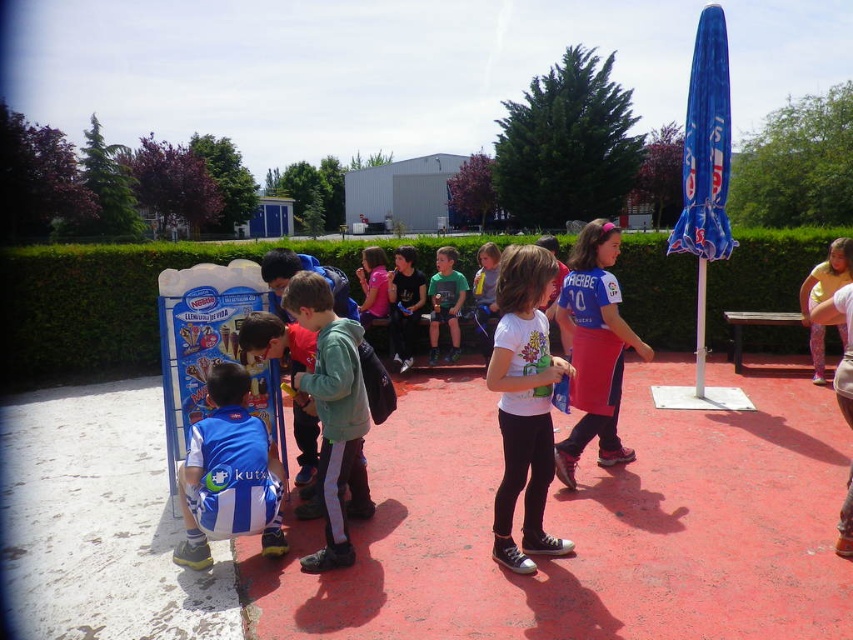
Question: Which point is farther to the camera?

Choices:
 (A) (514, 323)
 (B) (618, 298)
 (C) (131, 282)
 (D) (459, 282)

Answer: (D)

Question: Is pink fabric apron at center below blue and white jersey at lower left?

Choices:
 (A) yes
 (B) no

Answer: (B)

Question: Can you confirm if pink fabric apron at center is positioned to the right of green matte shirt at center?

Choices:
 (A) yes
 (B) no

Answer: (A)

Question: Which of the following is the farthest from the observer?

Choices:
 (A) green hedge at lower left
 (B) pink fabric apron at center
 (C) white matte t-shirt at center
 (D) blue and white jersey at lower left

Answer: (A)

Question: Estimate the real-world distances between objects in this image. Which object is farther from the green matte shirt at center?

Choices:
 (A) green hedge at lower left
 (B) white matte t-shirt at center

Answer: (B)

Question: Can you confirm if blue and white jersey at lower left is positioned below green matte shirt at center?

Choices:
 (A) no
 (B) yes

Answer: (B)